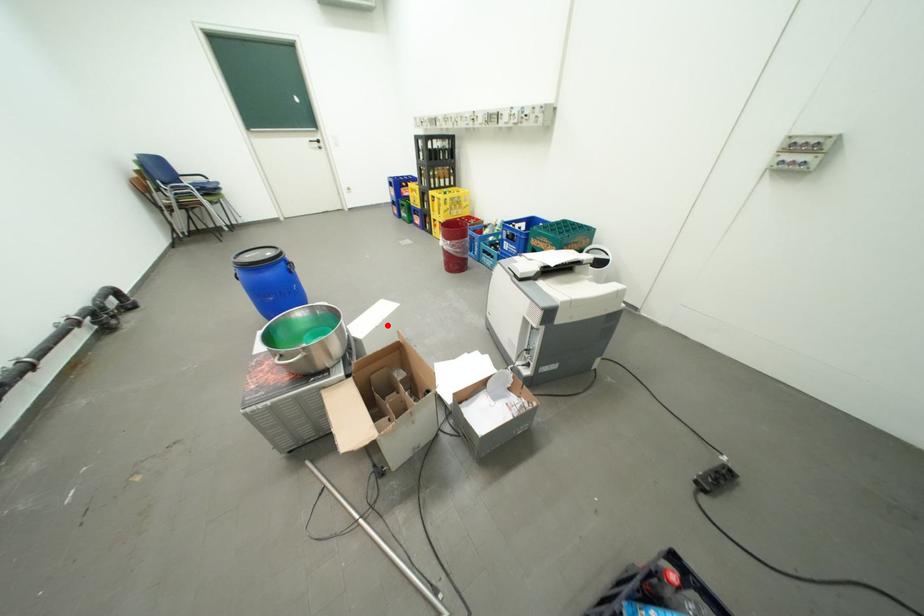
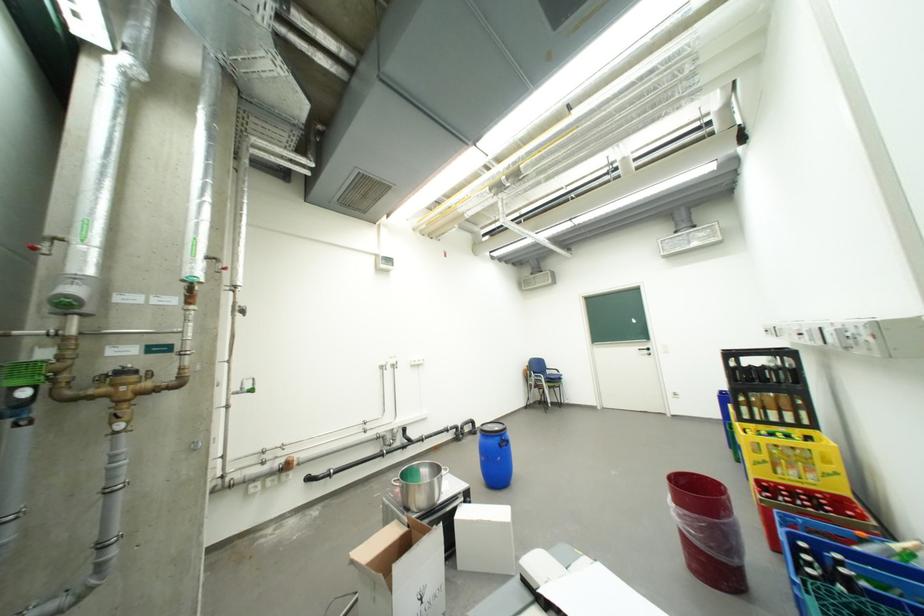
Question: A red point is marked in image1. In image2, is the corresponding 3D point closer to the camera or farther? Reply with the corresponding letter.

Choices:
 (A) The corresponding 3D point is closer.
 (B) The corresponding 3D point is farther.

Answer: (A)